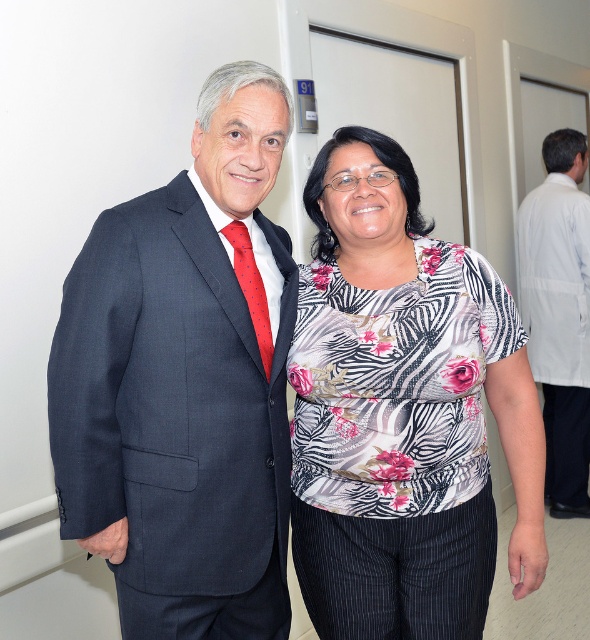
You are taking a photo of two people in a professional setting. You want to focus on the person closer to the camera. Which point should you use to adjust your focus? The options are point 1 at coordinates point (453,337) and point 2 at coordinates point (132,500).

Point 1 at coordinates point (453,337) is further to the camera than point 2 at coordinates point (132,500), so you should focus on point 1 at coordinates point (453,337) to capture the person closer to the camera.

You are an interior designer assessing the color contrast in this professional setting. Given the dark blue textured suit at left and the red dotted fabric tie at left, which object has a more dominant visual presence in terms of height?

The dark blue textured suit at left has a greater height compared to the red dotted fabric tie at left, making it the more dominant visual presence in terms of height.

You are an office assistant who needs to guide a visitor to the correct office. The visitor asks which person is closer to the door numbered 91. Based on the scene, which of the two people, the floral printed blouse at center or the dark blue textured suit at left, is positioned closer to the door?

The floral printed blouse at center is to the right of the dark blue textured suit at left. Since the door is marked on the wall, and both are positioned close together, the exact distance isn answerable without more info. However, the dark blue textured suit at left is on the left side, possibly nearer to the door if the door is on the left wall. But the scene doesn specify door location. Thus, cannot determine precisely.